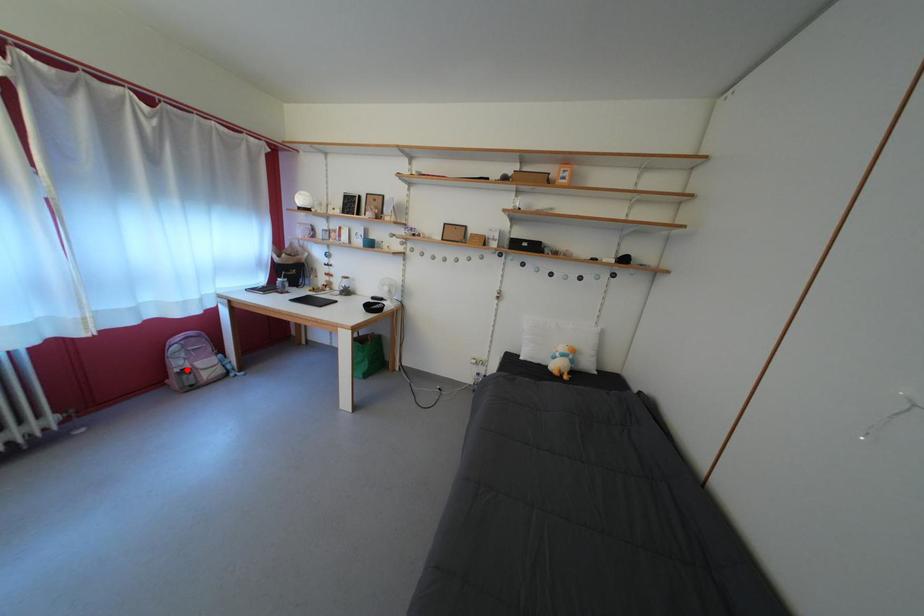
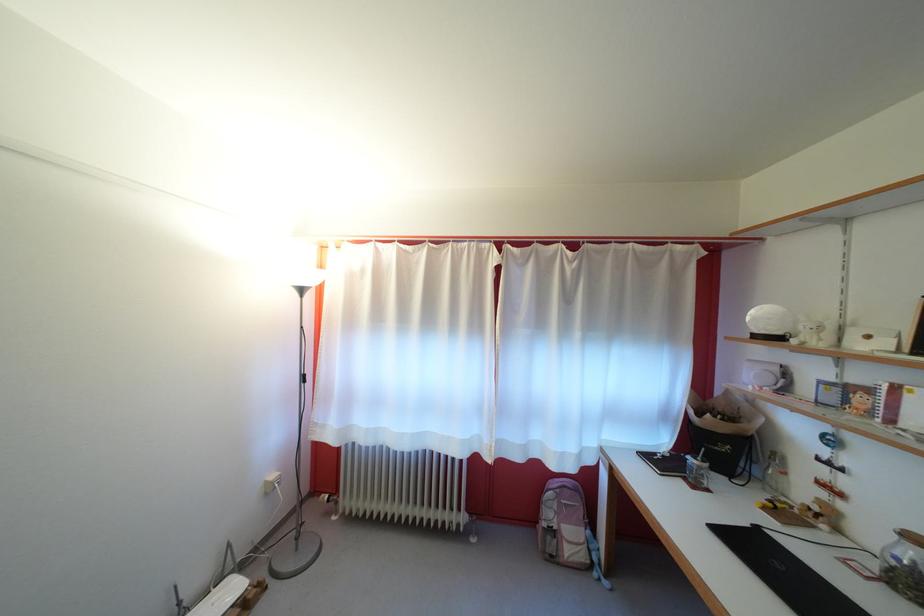
Question: I am providing you with two images of the same scene from different viewpoints. A red point is marked on the first image. Is the red point's position out of view in image 2?

Choices:
 (A) Yes
 (B) No

Answer: (B)